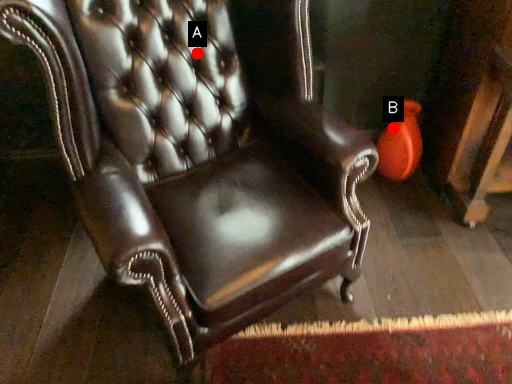
Question: Two points are circled on the image, labeled by A and B beside each circle. Which point is closer to the camera?

Choices:
 (A) A is closer
 (B) B is closer

Answer: (A)